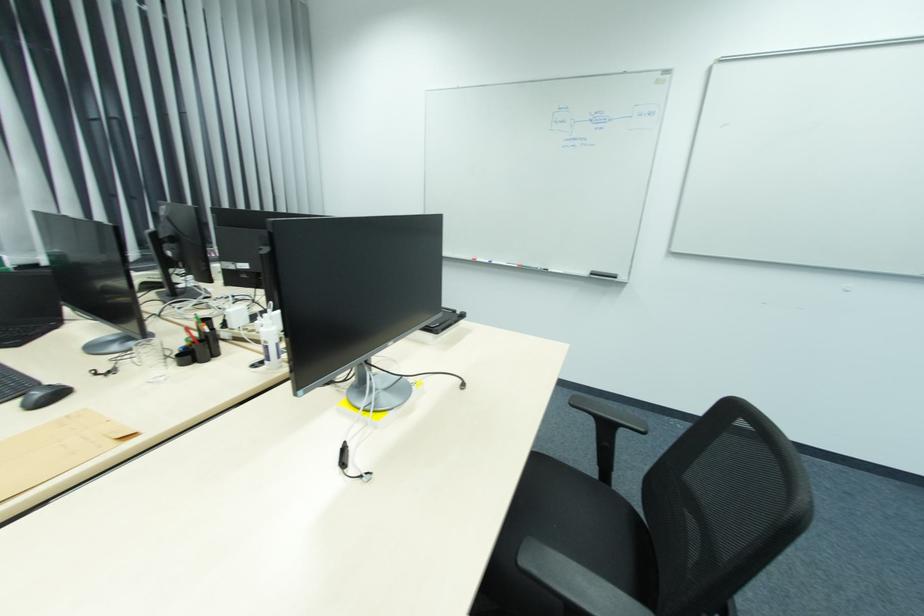
What do you see at coordinates (568, 538) in the screenshot? The width and height of the screenshot is (924, 616). I see `a chair sitting surface` at bounding box center [568, 538].